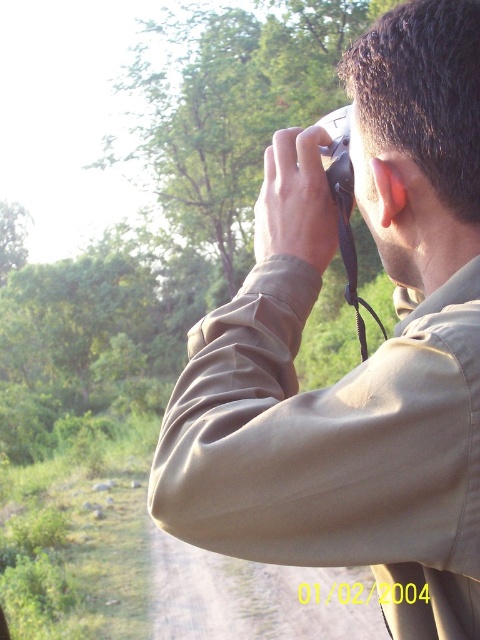
You are a photographer trying to decide whether to wear a larger jacket next time. You notice the matte khaki shirt at center and the black plastic camera at upper center in the image. Which item takes up more space in the photo?

The matte khaki shirt at center is bigger than the black plastic camera at upper center, so the matte khaki shirt at center takes up more space in the photo.

You are a photographer trying to frame a shot. You notice the matte khaki shirt at center and the black plastic camera at upper center in your viewfinder. Which object is positioned lower in the frame?

The matte khaki shirt at center is positioned below the black plastic camera at upper center, so it is lower in the frame.

You are a photographer trying to adjust your camera settings. You notice the matte khaki shirt at center and the black plastic camera at upper center in your view. Which object is closer to you, the photographer?

The matte khaki shirt at center is closer to you because it is in front of the black plastic camera at upper center.